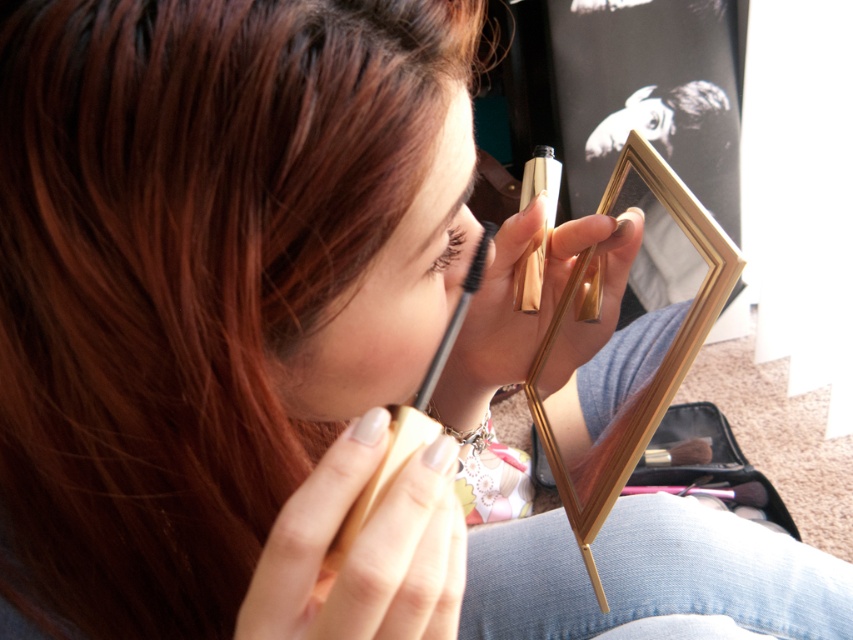
Question: Which of the following is the closest to the observer?

Choices:
 (A) brown matte eyebrow at upper center
 (B) matte black eyeliner at center
 (C) brown wooden brush at lower center

Answer: (B)

Question: Is black matte brush at center smaller than black matte eyeliner at upper center?

Choices:
 (A) yes
 (B) no

Answer: (B)

Question: Which is farther from the black matte eyeliner at upper center?

Choices:
 (A) matte black eyeliner at center
 (B) black matte brush at center
 (C) brown wooden brush at lower center
 (D) brown matte eyebrow at upper center

Answer: (C)

Question: Does brown wooden brush at lower center come in front of black matte eyeliner at upper center?

Choices:
 (A) yes
 (B) no

Answer: (B)

Question: Which point is farther to the camera?

Choices:
 (A) black matte brush at center
 (B) black matte eyeliner at upper center

Answer: (B)

Question: Does brown wooden brush at lower center lie in front of black matte eyeliner at upper center?

Choices:
 (A) no
 (B) yes

Answer: (A)